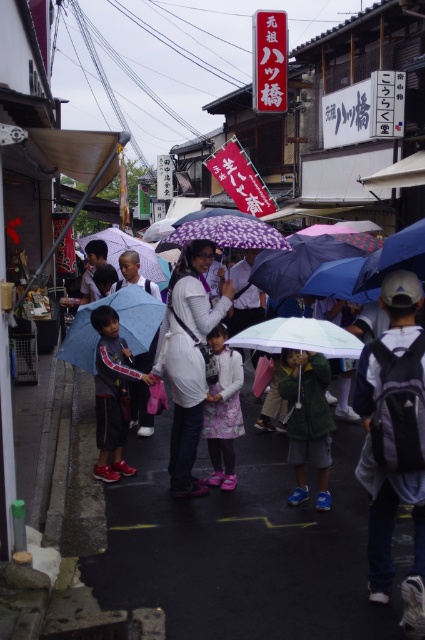
Can you confirm if gray fabric backpack at center is positioned to the left of matte white sweater at center?

Incorrect, gray fabric backpack at center is not on the left side of matte white sweater at center.

Does gray fabric backpack at center have a lesser width compared to matte white sweater at center?

Yes.

Is point (419, 422) in front of point (204, 317)?

Yes, it is.

The image size is (425, 640). Find the location of `gray fabric backpack at center`. gray fabric backpack at center is located at coordinates (394, 442).

Is gray fabric backpack at center smaller than green fuzzy coat at center?

No.

Is gray fabric backpack at center positioned in front of green fuzzy coat at center?

Yes, it is.

What do you see at coordinates (394, 442) in the screenshot? I see `gray fabric backpack at center` at bounding box center [394, 442].

This screenshot has width=425, height=640. What are the coordinates of `gray fabric backpack at center` in the screenshot? It's located at tap(394, 442).

Which is below, blue matte umbrella at center or translucent blue umbrella at center?

blue matte umbrella at center is lower down.

Image resolution: width=425 pixels, height=640 pixels. Describe the element at coordinates (119, 324) in the screenshot. I see `blue matte umbrella at center` at that location.

Which is in front, point (124, 298) or point (399, 234)?

Point (399, 234) is in front.

This screenshot has width=425, height=640. What are the coordinates of `blue matte umbrella at center` in the screenshot? It's located at (119, 324).